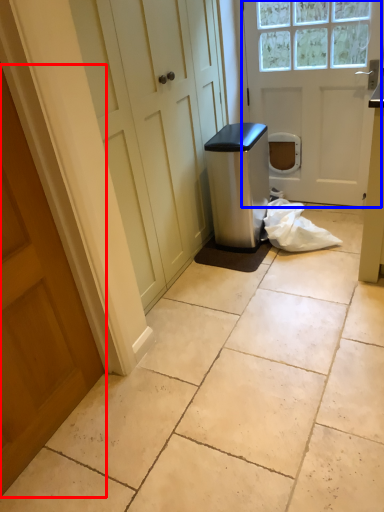
Question: Which point is closer to the camera, door (highlighted by a red box) or door (highlighted by a blue box)?

Choices:
 (A) door
 (B) door

Answer: (A)